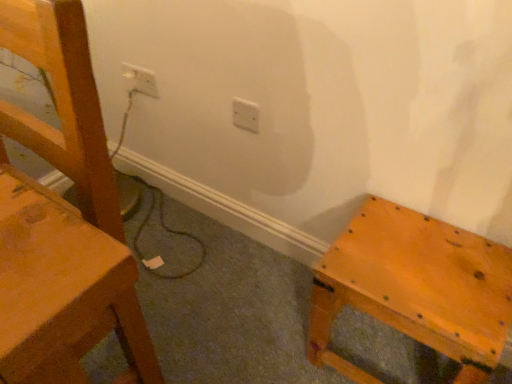
Question: Which direction should I rotate to look at white plastic electric outlet at center, which is the 2th electric outlet in top-to-bottom order?

Choices:
 (A) right
 (B) left

Answer: (B)

Question: Considering the relative positions of matte wooden stool at lower right and white plastic electric outlet at center, which is the 2th electric outlet in top-to-bottom order, in the image provided, is matte wooden stool at lower right in front of white plastic electric outlet at center, which is the 2th electric outlet in top-to-bottom order,?

Choices:
 (A) yes
 (B) no

Answer: (A)

Question: From the image's perspective, is matte wooden stool at lower right below white plastic electric outlet at center, which appears as the second electric outlet when viewed from the left?

Choices:
 (A) no
 (B) yes

Answer: (B)

Question: Is matte wooden stool at lower right to the left of white plastic electric outlet at center, which appears as the first electric outlet when viewed from the right, from the viewer's perspective?

Choices:
 (A) no
 (B) yes

Answer: (A)

Question: Is matte wooden stool at lower right oriented away from white plastic electric outlet at center, which appears as the first electric outlet when viewed from the right?

Choices:
 (A) yes
 (B) no

Answer: (B)

Question: Considering the relative positions of matte wooden stool at lower right and white plastic electric outlet at center, which appears as the first electric outlet when viewed from the right, in the image provided, is matte wooden stool at lower right behind white plastic electric outlet at center, which appears as the first electric outlet when viewed from the right,?

Choices:
 (A) yes
 (B) no

Answer: (B)

Question: Can you confirm if matte wooden stool at lower right is smaller than white plastic electric outlet at center, which appears as the second electric outlet when viewed from the left?

Choices:
 (A) yes
 (B) no

Answer: (B)

Question: Does white plastic electric outlet at upper left, the first electric outlet in the top-to-bottom sequence, touch white plastic electric outlet at center, which appears as the first electric outlet when viewed from the right?

Choices:
 (A) no
 (B) yes

Answer: (A)

Question: Considering the relative sizes of white plastic electric outlet at upper left, placed as the second electric outlet when sorted from bottom to top, and white plastic electric outlet at center, the second electric outlet when ordered from back to front, in the image provided, is white plastic electric outlet at upper left, placed as the second electric outlet when sorted from bottom to top, smaller than white plastic electric outlet at center, the second electric outlet when ordered from back to front,?

Choices:
 (A) yes
 (B) no

Answer: (B)

Question: Is the position of white plastic electric outlet at upper left, the first electric outlet in the top-to-bottom sequence, less distant than that of white plastic electric outlet at center, the first electric outlet when ordered from front to back?

Choices:
 (A) no
 (B) yes

Answer: (A)

Question: From a real-world perspective, is white plastic electric outlet at upper left, the first electric outlet in the top-to-bottom sequence, under white plastic electric outlet at center, the second electric outlet when ordered from back to front?

Choices:
 (A) yes
 (B) no

Answer: (A)

Question: Is white plastic electric outlet at upper left, placed as the 2th electric outlet when sorted from front to back, not inside white plastic electric outlet at center, which is the 2th electric outlet in top-to-bottom order?

Choices:
 (A) no
 (B) yes

Answer: (B)

Question: Does white plastic electric outlet at upper left, which ranks as the 2th electric outlet in right-to-left order, have a larger size compared to white plastic electric outlet at center, the first electric outlet when ordered from front to back?

Choices:
 (A) yes
 (B) no

Answer: (A)

Question: Are matte wood chair at left and matte wooden stool at lower right far apart?

Choices:
 (A) yes
 (B) no

Answer: (B)